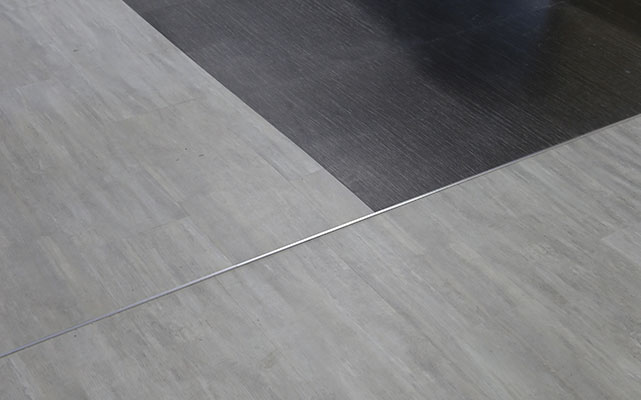
In order to click on gray laminate flooring on upper left in this screenshot , I will do `click(135, 192)`.